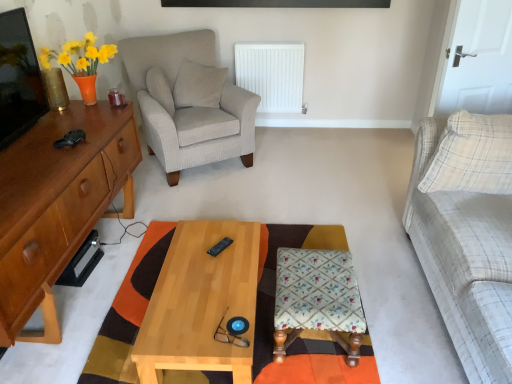
Question: From the image's perspective, is light wood/texture coffee table at center under white plastic radiator at center?

Choices:
 (A) yes
 (B) no

Answer: (A)

Question: From the image's perspective, is light wood/texture coffee table at center above white plastic radiator at center?

Choices:
 (A) yes
 (B) no

Answer: (B)

Question: Is light wood/texture coffee table at center completely or partially outside of white plastic radiator at center?

Choices:
 (A) yes
 (B) no

Answer: (A)

Question: Does light wood/texture coffee table at center have a lesser width compared to white plastic radiator at center?

Choices:
 (A) yes
 (B) no

Answer: (B)

Question: Does light wood/texture coffee table at center touch white plastic radiator at center?

Choices:
 (A) no
 (B) yes

Answer: (A)

Question: From the image's perspective, is matte wood dresser at left positioned above or below white fabric pillow at upper center, which is counted as the 3th pillow, starting from the right?

Choices:
 (A) above
 (B) below

Answer: (B)

Question: Is matte wood dresser at left situated inside white fabric pillow at upper center, the second pillow when ordered from front to back, or outside?

Choices:
 (A) inside
 (B) outside

Answer: (B)

Question: Considering their positions, is matte wood dresser at left located in front of or behind white fabric pillow at upper center, which is counted as the 3th pillow, starting from the right?

Choices:
 (A) behind
 (B) front

Answer: (B)

Question: From their relative heights in the image, would you say matte wood dresser at left is taller or shorter than white fabric pillow at upper center, the second pillow when ordered from front to back?

Choices:
 (A) short
 (B) tall

Answer: (B)

Question: From the image's perspective, is plaid fabric couch at right positioned above or below yellow matte vase at upper left?

Choices:
 (A) below
 (B) above

Answer: (A)

Question: Is plaid fabric couch at right wider or thinner than yellow matte vase at upper left?

Choices:
 (A) thin
 (B) wide

Answer: (B)

Question: Is point (446, 183) positioned closer to the camera than point (72, 64)?

Choices:
 (A) farther
 (B) closer

Answer: (B)

Question: From a real-world perspective, is plaid fabric couch at right positioned above or below yellow matte vase at upper left?

Choices:
 (A) below
 (B) above

Answer: (A)

Question: Is checkered fabric pillow at upper center, the third pillow in the front-to-back sequence, bigger or smaller than white plastic radiator at center?

Choices:
 (A) big
 (B) small

Answer: (B)

Question: Is checkered fabric pillow at upper center, the third pillow in the front-to-back sequence, to the left or to the right of white plastic radiator at center in the image?

Choices:
 (A) left
 (B) right

Answer: (A)